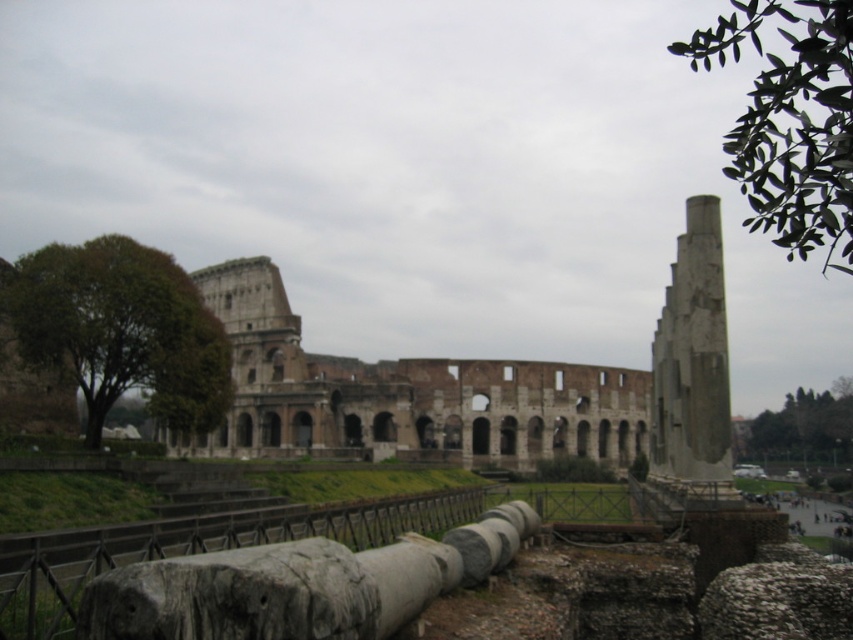
Which is in front, point (306, 394) or point (700, 387)?

Positioned in front is point (700, 387).

From the picture: Does brown stone ruins at center appear under gray stone column at right?

Yes, brown stone ruins at center is below gray stone column at right.

What do you see at coordinates (480, 385) in the screenshot? I see `brown stone ruins at center` at bounding box center [480, 385].

This screenshot has height=640, width=853. In order to click on brown stone ruins at center in this screenshot , I will do `click(480, 385)`.